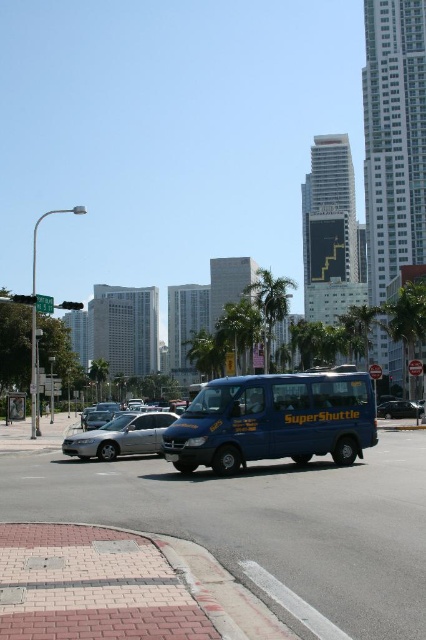
You are a pedestrian standing on the sidewalk. You see the blue matte van at center and the green leafy palm tree at center. Which object is taller?

The green leafy palm tree at center is taller than the blue matte van at center.

You are a pedestrian standing on the sidewalk and want to cross the street. You see the blue matte van at center and the green leafy palm tree at center. Which object is closer to you?

The blue matte van at center is closer to you because it is in front of the green leafy palm tree at center.

Looking at this image, you are a delivery person trying to park your 6 feet tall box in the space between the blue matte van at center and the silver metallic sedan at center. Can the box fit vertically between them?

The blue matte van at center is taller than the silver metallic sedan at center. Since the box is 6 feet tall, it might not fit if the space between them is constrained by the van height. However, without knowing the exact vertical clearance, it is uncertain. Please check the available height between the two vehicles.